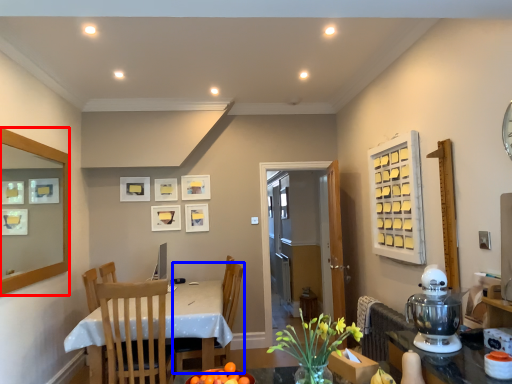
Question: Among these objects, which one is nearest to the camera, mirror (highlighted by a red box) or chair (highlighted by a blue box)?

Choices:
 (A) mirror
 (B) chair

Answer: (A)